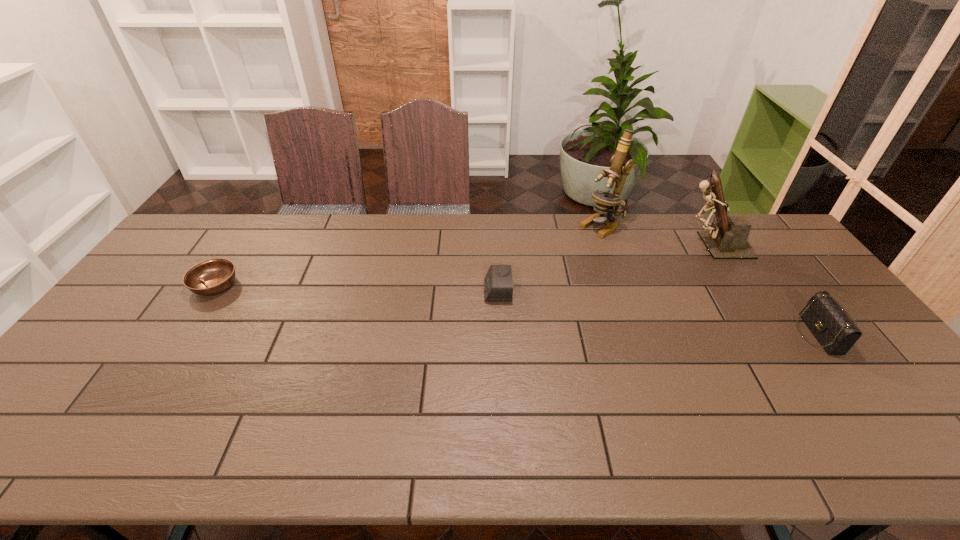
At what (x,y) coordinates should I click in order to perform the action: click on empty space between the fourth shortest object and the nearest object. Please return your answer as a coordinate pair (x, y). Looking at the image, I should click on (765, 289).

The image size is (960, 540). I want to click on free area in between the leftmost object and the third object from left to right, so click(408, 256).

This screenshot has height=540, width=960. Find the location of `free space that is in between the microscope and the soup bowl`. free space that is in between the microscope and the soup bowl is located at coordinates (408, 256).

In order to click on free space between the figurine and the third shortest object in this screenshot , I will do `click(765, 289)`.

Locate an element on the screen. free space between the second object from left to right and the fourth shortest object is located at coordinates (605, 268).

The image size is (960, 540). I want to click on vacant space that's between the tallest object and the third shortest object, so click(x=708, y=280).

This screenshot has width=960, height=540. In order to click on unoccupied position between the second shortest object and the shortest object in this screenshot , I will do `click(356, 288)`.

This screenshot has height=540, width=960. In order to click on free space between the nearest object and the second shortest object in this screenshot , I will do `click(658, 313)`.

Locate an element on the screen. unoccupied area between the soup bowl and the alarm clock is located at coordinates (356, 288).

Where is `free point between the fourth shortest object and the alarm clock`? free point between the fourth shortest object and the alarm clock is located at coordinates (605, 268).